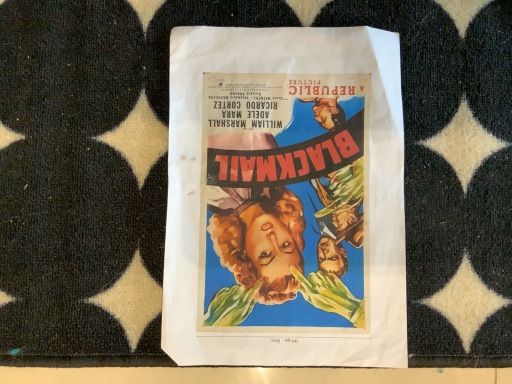
Image resolution: width=512 pixels, height=384 pixels. Describe the element at coordinates (285, 198) in the screenshot. I see `vibrant paper poster at center` at that location.

Identify the location of vibrant paper poster at center. The width and height of the screenshot is (512, 384). (285, 198).

I want to click on vibrant paper poster at center, so click(285, 198).